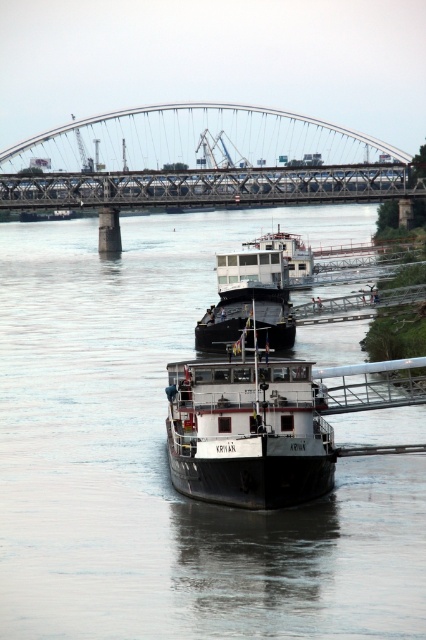
Can you confirm if black matte barge at center is positioned to the left of white matte barge at center?

Indeed, black matte barge at center is positioned on the left side of white matte barge at center.

Is point (135, 384) more distant than point (279, 394)?

Yes, it is behind point (279, 394).

Who is more forward, (66, 625) or (169, 419)?

Point (66, 625) is more forward.

Find the location of a particular element. black matte barge at center is located at coordinates (166, 460).

In the scene shown: Which is below, metallic gray bridge at upper center or white matte barge at center?

white matte barge at center

Is metallic gray bridge at upper center to the left of white matte barge at center from the viewer's perspective?

Indeed, metallic gray bridge at upper center is positioned on the left side of white matte barge at center.

I want to click on metallic gray bridge at upper center, so click(x=198, y=163).

Consider the image. Is black matte barge at center bigger than metallic gray bridge at upper center?

Yes, black matte barge at center is bigger than metallic gray bridge at upper center.

Does black matte barge at center come behind metallic gray bridge at upper center?

No, it is in front of metallic gray bridge at upper center.

This screenshot has width=426, height=640. In order to click on black matte barge at center in this screenshot , I will do `click(166, 460)`.